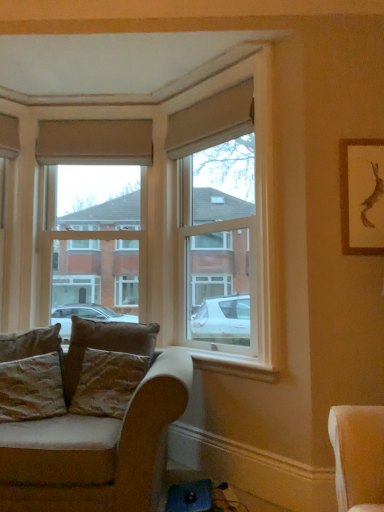
Where is `free location above white painted wood at lower right (from a real-world perspective)`? The height and width of the screenshot is (512, 384). free location above white painted wood at lower right (from a real-world perspective) is located at coordinates (215, 352).